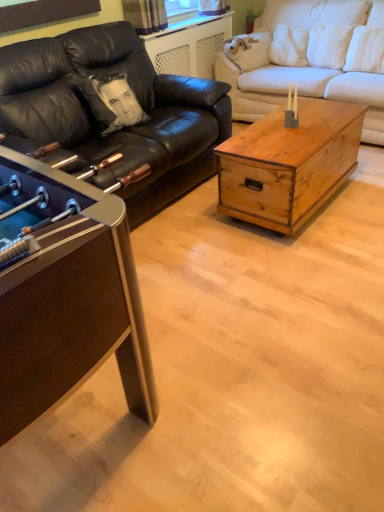
Question: Looking at the image, does metallic brown foosball table at left, which is the first coffee table from left to right, seem bigger or smaller compared to white fabric couch at center, which is counted as the 1th studio couch, starting from the right?

Choices:
 (A) small
 (B) big

Answer: (A)

Question: Does point (36, 374) appear closer or farther from the camera than point (259, 73)?

Choices:
 (A) closer
 (B) farther

Answer: (A)

Question: Estimate the real-world distances between objects in this image. Which object is closer to the metallic brown foosball table at left, which is the first coffee table from left to right?

Choices:
 (A) white fabric couch at center, the 2th studio couch from the left
 (B) black leather couch at left, arranged as the second studio couch when viewed from the right
 (C) white satin pillow at upper right
 (D) rustic wood trunk at center, which appears as the 1th coffee table when viewed from the right

Answer: (B)

Question: Which is nearer to the black leather couch at left, positioned as the first studio couch in left-to-right order?

Choices:
 (A) metallic brown foosball table at left, which is the first coffee table from left to right
 (B) white satin pillow at upper right
 (C) rustic wood trunk at center, which appears as the 1th coffee table when viewed from the right
 (D) white fabric couch at center, which is counted as the 1th studio couch, starting from the right

Answer: (C)